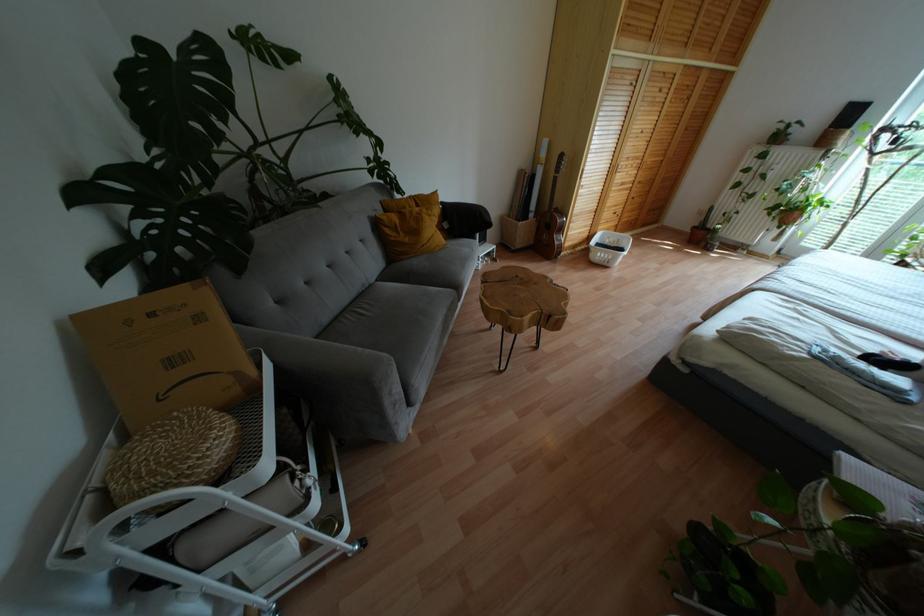
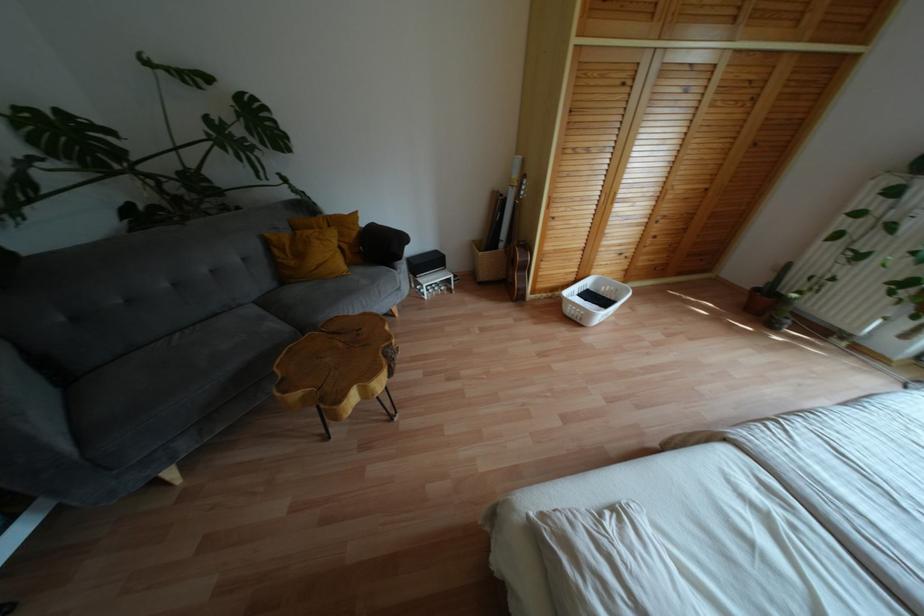
Locate, in the second image, the point that corresponds to the point at 361,291 in the first image.

(224, 312)